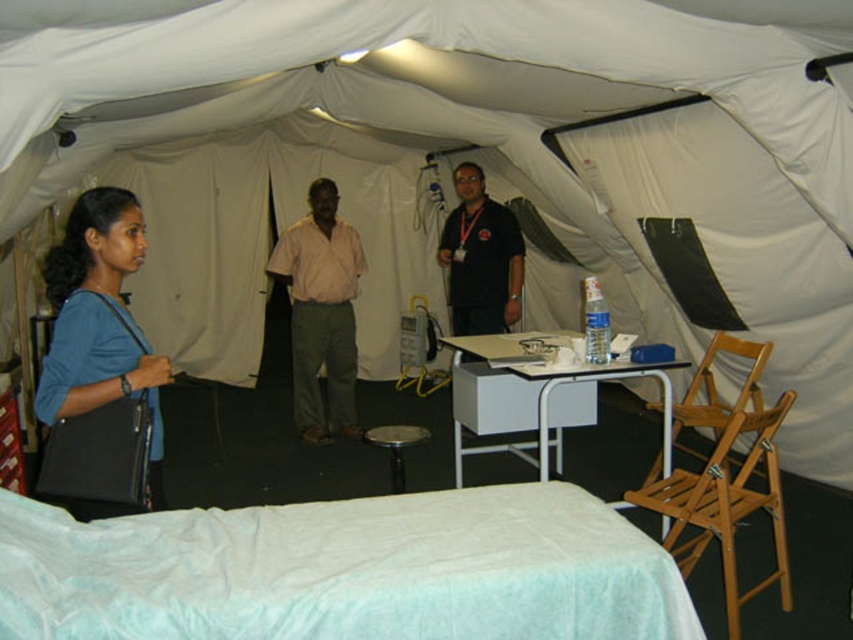
Which is above, pink cotton shirt at center or metallic silver stool at center?

Positioned higher is pink cotton shirt at center.

Which is in front, point (323, 424) or point (410, 445)?

Point (410, 445) is in front.

Find the location of a particular element. pink cotton shirt at center is located at coordinates (321, 312).

Is matte black bag at lower left shorter than white glossy table at center?

Incorrect, matte black bag at lower left's height does not fall short of white glossy table at center's.

Based on the photo, does matte black bag at lower left appear over white glossy table at center?

Indeed, matte black bag at lower left is positioned over white glossy table at center.

Image resolution: width=853 pixels, height=640 pixels. What do you see at coordinates (99, 368) in the screenshot?
I see `matte black bag at lower left` at bounding box center [99, 368].

You are a GUI agent. You are given a task and a screenshot of the screen. Output one action in this format:
    pyautogui.click(x=<x>, y=<y>)
    Task: Click on the matte black bag at lower left
    This screenshot has height=640, width=853.
    Given the screenshot: What is the action you would take?
    pyautogui.click(x=99, y=368)

Can you confirm if white glossy table at center is positioned above pink cotton shirt at center?

Actually, white glossy table at center is below pink cotton shirt at center.

Between white glossy table at center and pink cotton shirt at center, which one has less height?

With less height is white glossy table at center.

Where is `white glossy table at center`? This screenshot has height=640, width=853. white glossy table at center is located at coordinates (535, 394).